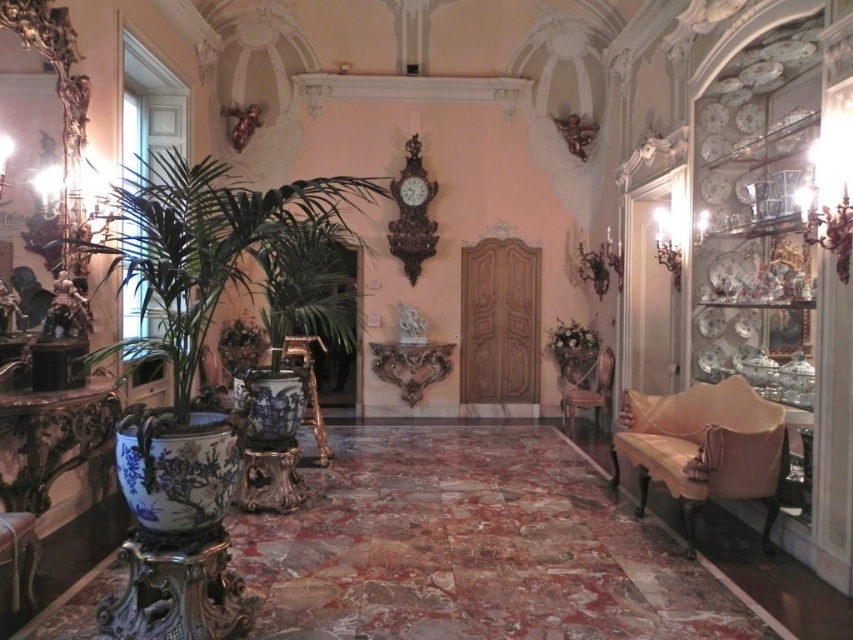
Question: Is blue glazed pot at left smaller than gold polished wood armchair at center?

Choices:
 (A) yes
 (B) no

Answer: (B)

Question: Among these objects, which one is farthest from the camera?

Choices:
 (A) blue glazed pot at left
 (B) polished bronze clock at upper center

Answer: (B)

Question: Does velvet beige armchair at right come behind gold polished wood armchair at center?

Choices:
 (A) no
 (B) yes

Answer: (A)

Question: Which object is closer to the camera taking this photo?

Choices:
 (A) gold polished wood armchair at center
 (B) wooden armchair at right
 (C) blue glazed pot at left

Answer: (C)

Question: Does polished bronze clock at upper center come in front of gold polished wood armchair at center?

Choices:
 (A) yes
 (B) no

Answer: (B)

Question: Which object is closer to the camera taking this photo?

Choices:
 (A) blue glazed pot at left
 (B) wooden armchair at right
 (C) gold polished wood armchair at center

Answer: (A)